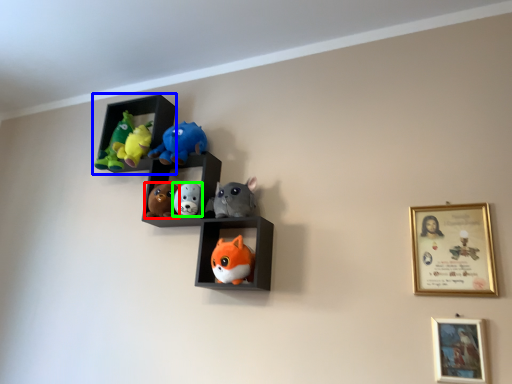
Question: Based on their relative distances, which object is nearer to toy (highlighted by a red box)? Choose from shelf (highlighted by a blue box) and toy (highlighted by a green box).

Choices:
 (A) shelf
 (B) toy

Answer: (B)